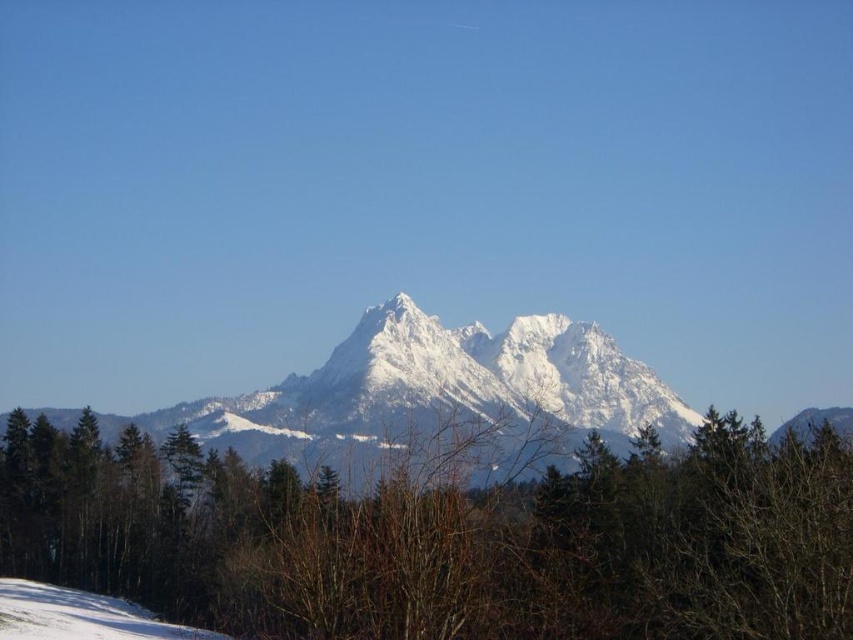
Which of these two, green matte tree at center or white snow at lower left, stands taller?

With more height is green matte tree at center.

Which is in front, point (140, 570) or point (80, 620)?

Point (80, 620)

Is point (809, 484) farther from viewer compared to point (16, 589)?

No, it is in front of (16, 589).

Identify the location of green matte tree at center. The width and height of the screenshot is (853, 640). (447, 540).